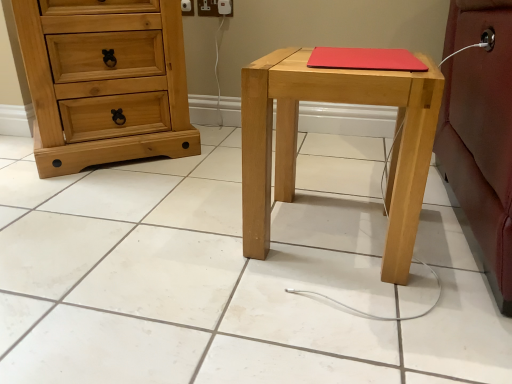
Where is `vacant space positioned to the left of natural wood stool at center`? vacant space positioned to the left of natural wood stool at center is located at coordinates (191, 236).